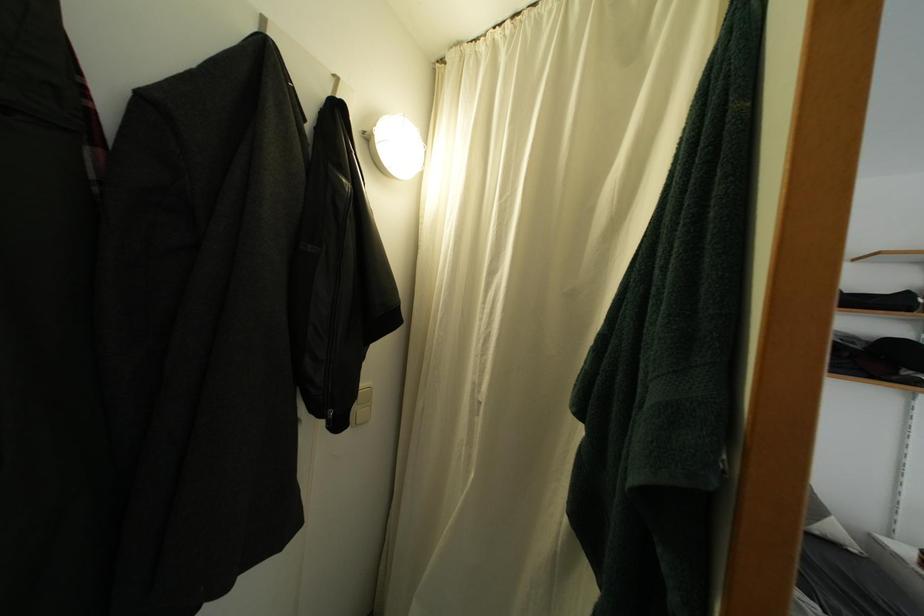
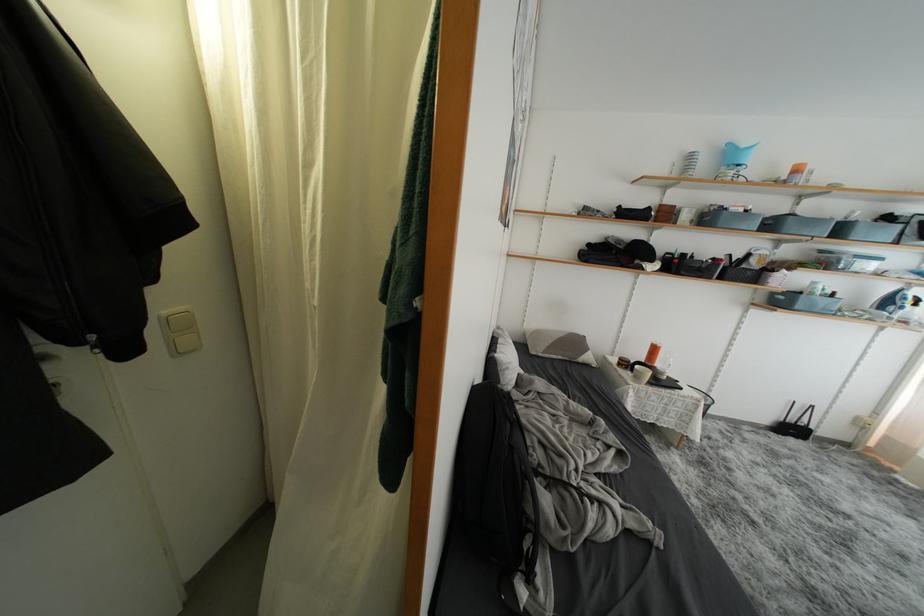
First-person continuous shooting, in which direction is the camera rotating?

The camera rotated toward right-down.